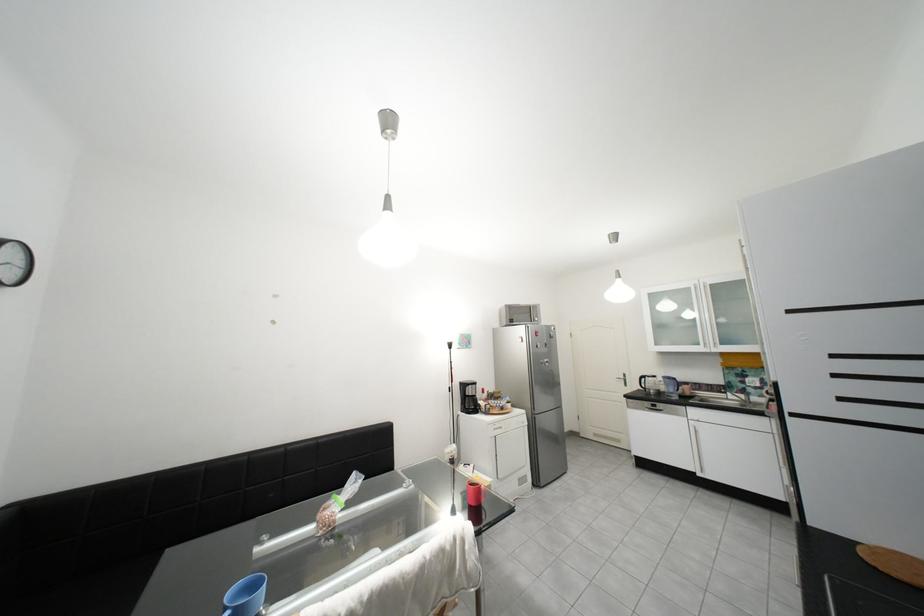
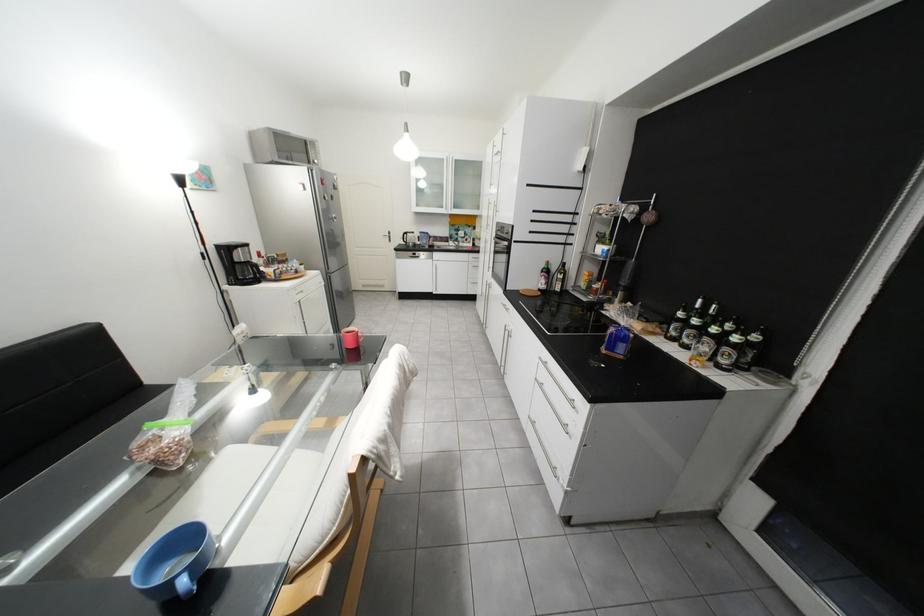
Where in the second image is the point corresponding to [535,411] from the first image?

(330, 273)